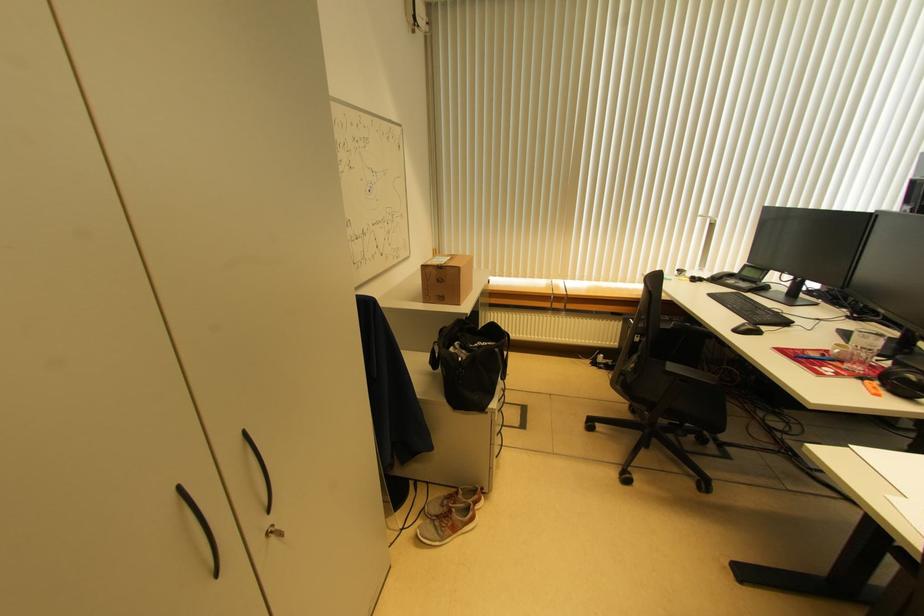
Find the location of a particular element. The image size is (924, 616). cabinet lock is located at coordinates (274, 532).